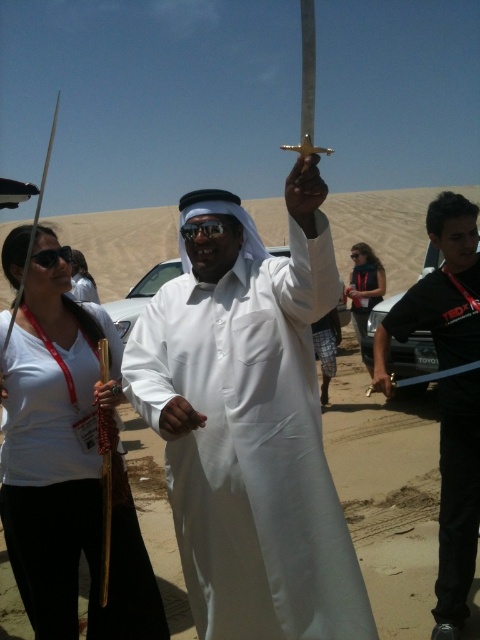
You are standing in the desert scene and want to reach a specific point marked at coordinates point (317,316). If you can walk 3 feet per second, how many seconds will it take you to reach that point?

The distance of point (317,316) from viewer is 7.08 feet. At a walking speed of 3 feet per second, it would take approximately 2.36 seconds to reach the point.

You are a photographer setting up for a group photo in the desert. You notice the white matte sword at center and the denim jacket at center. Which object is closer to the camera?

The white matte sword at center is positioned under the denim jacket at center, so the denim jacket at center is closer to the camera.